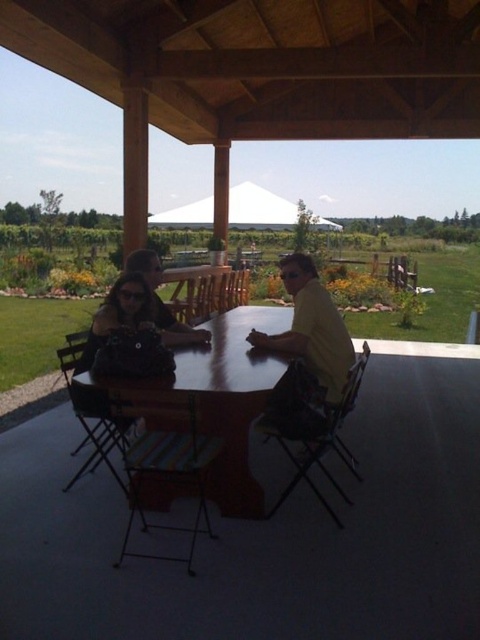
Question: Which point appears farthest from the camera in this image?

Choices:
 (A) (278, 228)
 (B) (276, 394)

Answer: (A)

Question: Estimate the real-world distances between objects in this image. Which object is closer to the wooden table at center?

Choices:
 (A) yellow matte shirt at center
 (B) white fabric canopy at upper center

Answer: (A)

Question: Among these points, which one is nearest to the camera?

Choices:
 (A) (213, 218)
 (B) (308, 417)
 (C) (205, 387)

Answer: (C)

Question: Is yellow matte shirt at center above white fabric canopy at upper center?

Choices:
 (A) no
 (B) yes

Answer: (A)

Question: Can you confirm if wooden table at center is positioned above yellow matte shirt at center?

Choices:
 (A) no
 (B) yes

Answer: (A)

Question: Does yellow matte shirt at center have a lesser width compared to white fabric canopy at upper center?

Choices:
 (A) no
 (B) yes

Answer: (B)